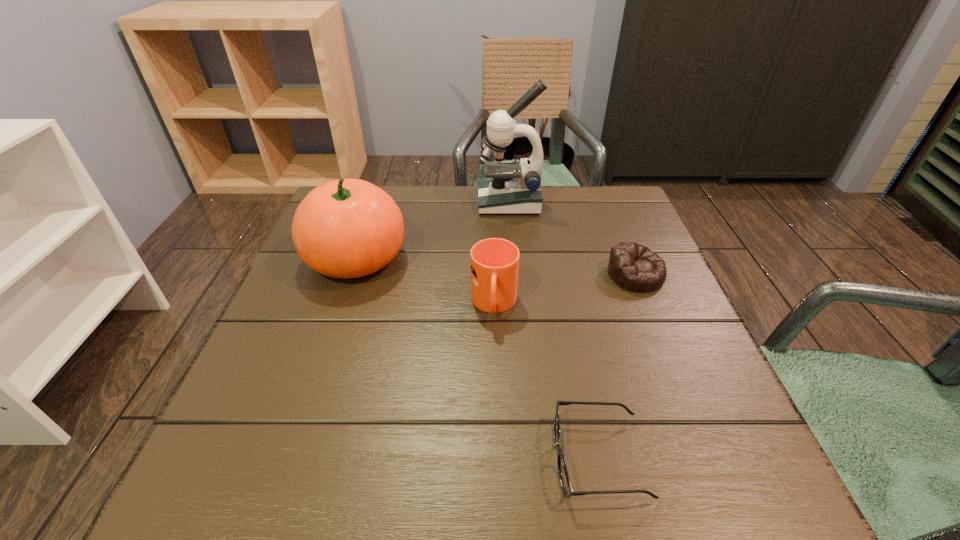
You are a GUI agent. You are given a task and a screenshot of the screen. Output one action in this format:
    pyautogui.click(x=<x>, y=<y>)
    Task: Click on the free space located on the front of the leftmost object
    
    Given the screenshot: What is the action you would take?
    point(338,309)

Identify the location of vacant region located on the handle side of the third tallest object. (499, 444).

I want to click on free space located 0.170m on the left of the rightmost object, so click(x=532, y=274).

Identify the location of blank area located on the front-facing side of the nearest object. The height and width of the screenshot is (540, 960). (461, 458).

Find the location of `free spot located on the front-facing side of the nearest object`. free spot located on the front-facing side of the nearest object is located at coordinates (290, 458).

Image resolution: width=960 pixels, height=540 pixels. Identify the location of free location located on the front-facing side of the nearest object. (336, 458).

I want to click on microscope that is positioned at the far edge, so click(515, 188).

Image resolution: width=960 pixels, height=540 pixels. I want to click on pumpkin positioned at the far edge, so click(x=348, y=228).

This screenshot has height=540, width=960. I want to click on object located in the near edge section of the desktop, so click(x=564, y=479).

At what (x,y) coordinates should I click in order to perform the action: click on object at the left edge. Please return your answer as a coordinate pair (x, y). This screenshot has width=960, height=540. Looking at the image, I should click on (348, 228).